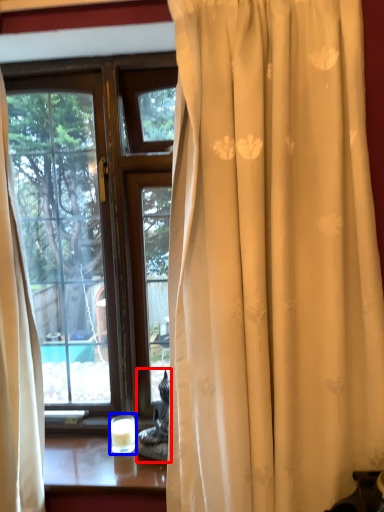
Question: Which object appears farthest to the camera in this image, chair (highlighted by a red box) or candle holder (highlighted by a blue box)?

Choices:
 (A) chair
 (B) candle holder

Answer: (B)